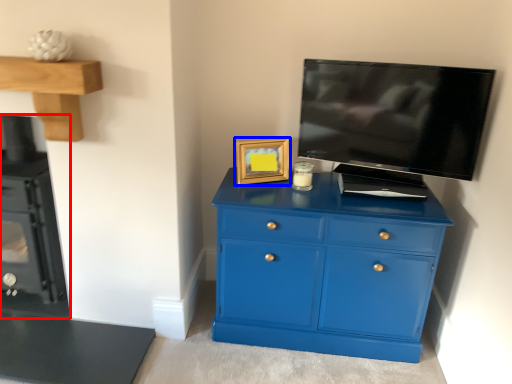
Question: Which object appears closest to the camera in this image, appliance (highlighted by a red box) or picture frame (highlighted by a blue box)?

Choices:
 (A) appliance
 (B) picture frame

Answer: (A)